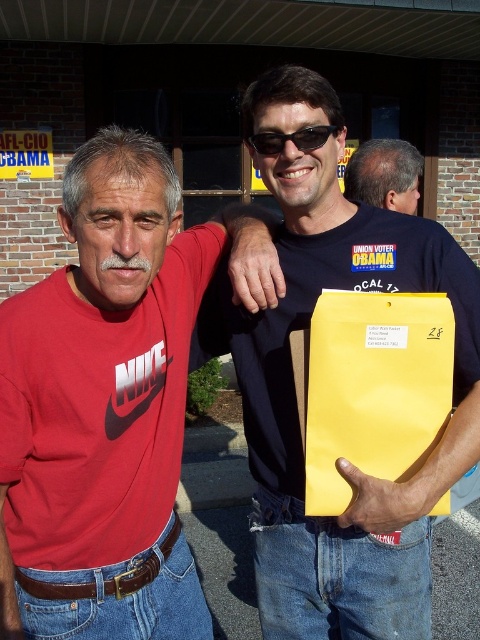
You are a photographer trying to capture a closeup of the matte black shirt at center and the yellow paper envelope at center. Given that your camera can only focus on objects within 15 centimeters of each other, will you need to adjust your position to ensure both are in focus?

The distance between the matte black shirt at center and yellow paper envelope at center is 17.18 centimeters, which exceeds the camera focus range of 15 centimeters. Therefore, you will need to adjust your position to ensure both are within the required distance for clear focus.